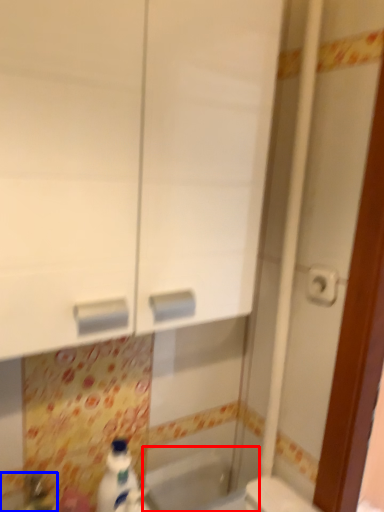
Question: Among these objects, which one is farthest to the camera, bath (highlighted by a red box) or sink (highlighted by a blue box)?

Choices:
 (A) bath
 (B) sink

Answer: (A)